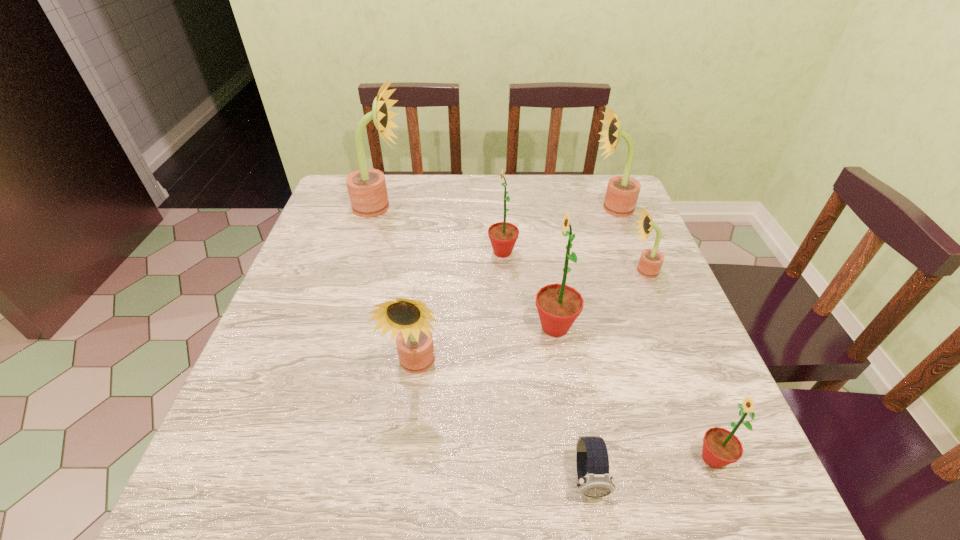
Identify the location of vacant region that satisfies the following two spatial constraints: 1. on the face of the third smallest yellow sunflower; 2. on the face of the second sunflower from left to right. The image size is (960, 540). (672, 366).